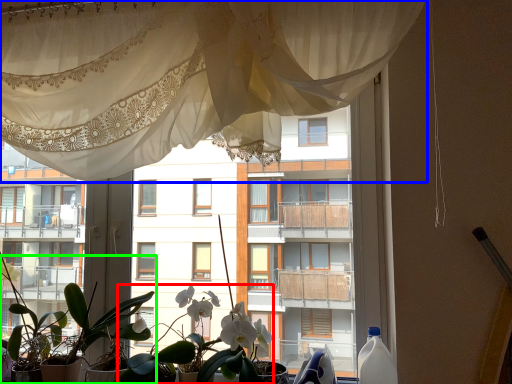
Question: Which object is the closest to the floral arrangement (highlighted by a red box)? Choose among these: curtain (highlighted by a blue box) or houseplant (highlighted by a green box).

Choices:
 (A) curtain
 (B) houseplant

Answer: (B)